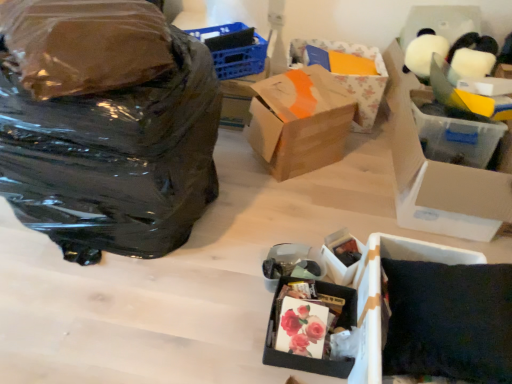
You are a GUI agent. You are given a task and a screenshot of the screen. Output one action in this format:
    pyautogui.click(x=<x>, y=<y>)
    Task: Click on the vacant area that is situated to the right of black plastic bag at left
    
    Given the screenshot: What is the action you would take?
    pyautogui.click(x=252, y=226)